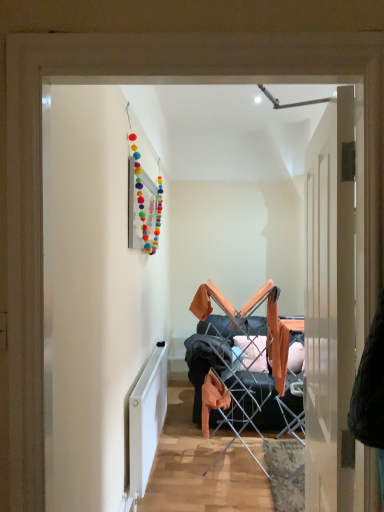
Question: Visually, is wooden door at right positioned to the left or to the right of white matte radiator at lower left?

Choices:
 (A) left
 (B) right

Answer: (B)

Question: From a real-world perspective, is wooden door at right physically located above or below white matte radiator at lower left?

Choices:
 (A) below
 (B) above

Answer: (B)

Question: Is wooden door at right bigger or smaller than white matte radiator at lower left?

Choices:
 (A) small
 (B) big

Answer: (B)

Question: In the image, is white matte radiator at lower left on the left side or the right side of wooden door at right?

Choices:
 (A) right
 (B) left

Answer: (B)

Question: Is point (132, 400) closer or farther from the camera than point (339, 260)?

Choices:
 (A) farther
 (B) closer

Answer: (A)

Question: From the image's perspective, is white matte radiator at lower left positioned above or below wooden door at right?

Choices:
 (A) above
 (B) below

Answer: (B)

Question: Is white matte radiator at lower left bigger or smaller than wooden door at right?

Choices:
 (A) small
 (B) big

Answer: (A)